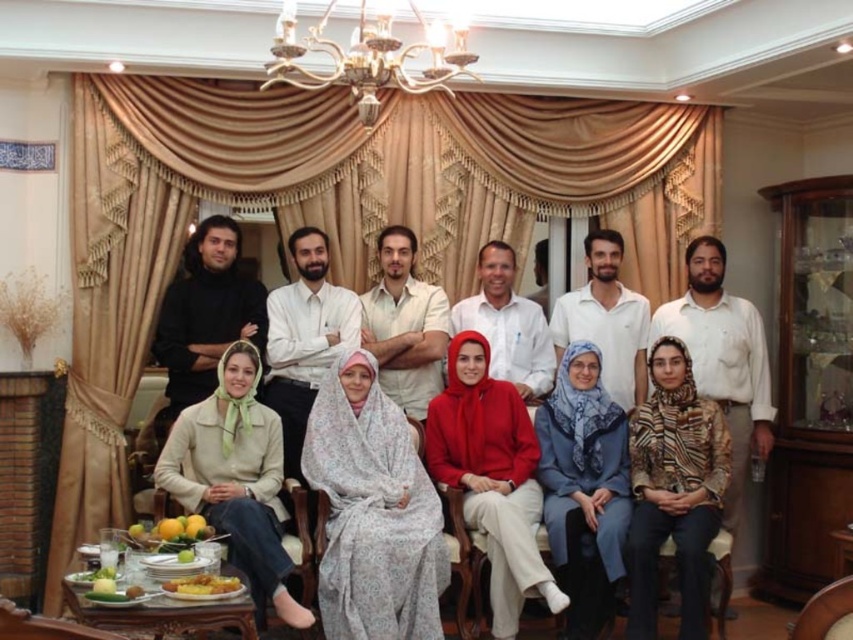
Question: Is floral-patterned dress at center above gold metallic chandelier at upper center?

Choices:
 (A) no
 (B) yes

Answer: (A)

Question: Among these objects, which one is farthest from the camera?

Choices:
 (A) floral-patterned dress at center
 (B) gold metallic chandelier at upper center

Answer: (A)

Question: Does floral-patterned dress at center appear over gold metallic chandelier at upper center?

Choices:
 (A) yes
 (B) no

Answer: (B)

Question: Can you confirm if floral-patterned dress at center is positioned to the right of gold metallic chandelier at upper center?

Choices:
 (A) yes
 (B) no

Answer: (A)

Question: Which of the following is the farthest from the observer?

Choices:
 (A) floral-patterned dress at center
 (B) gold metallic chandelier at upper center

Answer: (A)